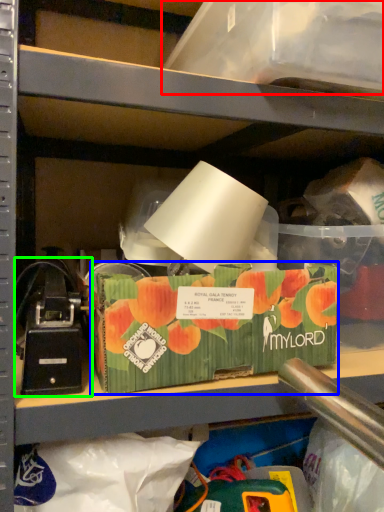
Question: Estimate the real-world distances between objects in this image. Which object is farther from storage box (highlighted by a red box), storage box (highlighted by a blue box) or toy (highlighted by a green box)?

Choices:
 (A) storage box
 (B) toy

Answer: (B)